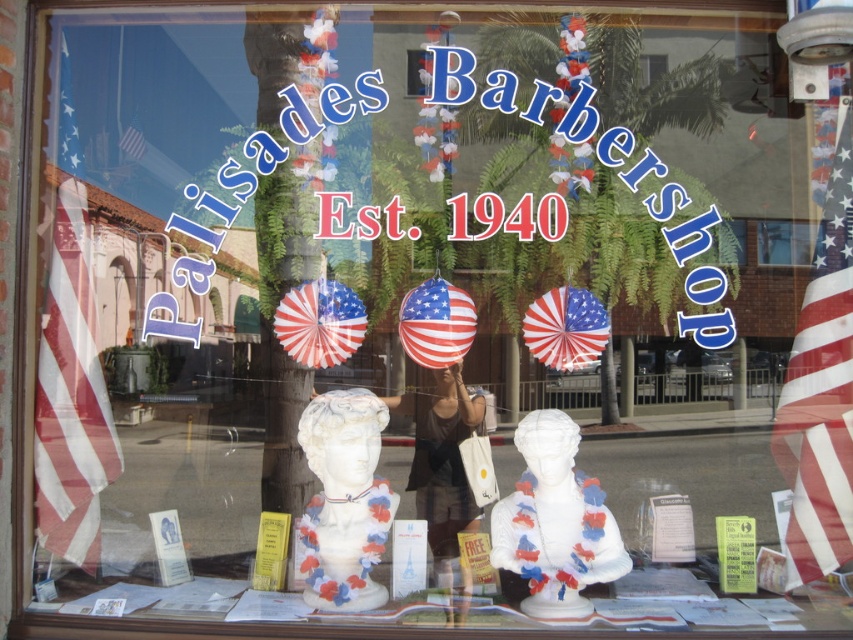
Question: Which point is closer to the camera?

Choices:
 (A) white marble bust at center
 (B) matte brown shirt at center
 (C) red-white-striped fabric flag at left
 (D) white glossy bust at center

Answer: (D)

Question: From the image, what is the correct spatial relationship of american flag at right in relation to matte brown shirt at center?

Choices:
 (A) left
 (B) right

Answer: (B)

Question: Which point is closer to the camera?

Choices:
 (A) white glossy bust at center
 (B) white marble bust at center

Answer: (A)

Question: Which is nearer to the white marble bust at center?

Choices:
 (A) matte brown shirt at center
 (B) american flag at right
 (C) white glossy bust at center
 (D) red-white-striped fabric flag at left

Answer: (A)

Question: Is the position of red-white-striped fabric flag at left more distant than that of white marble bust at center?

Choices:
 (A) yes
 (B) no

Answer: (A)

Question: Is red-white-striped fabric flag at left to the right of white glossy bust at center from the viewer's perspective?

Choices:
 (A) no
 (B) yes

Answer: (A)